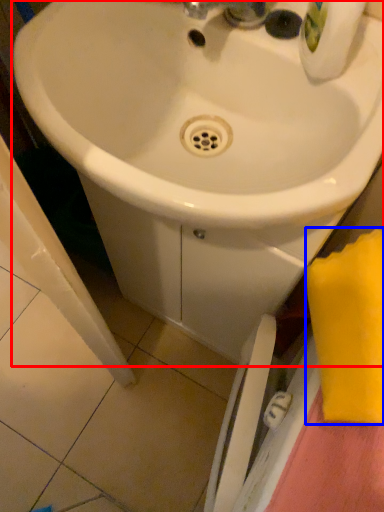
Question: Among these objects, which one is farthest to the camera, sink (highlighted by a red box) or beach towel (highlighted by a blue box)?

Choices:
 (A) sink
 (B) beach towel

Answer: (A)